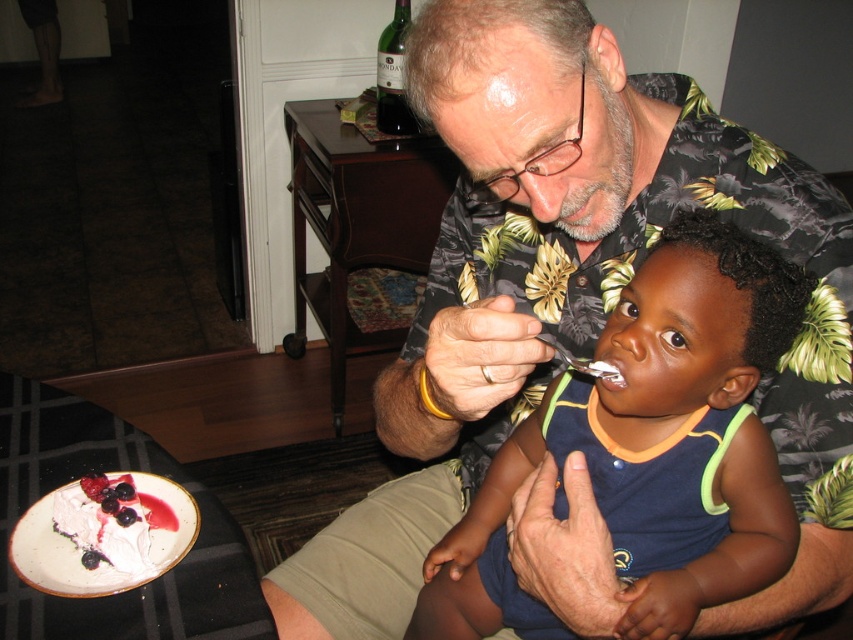
Question: Which point is farther to the camera?

Choices:
 (A) (495, 483)
 (B) (531, 532)
 (C) (85, 508)

Answer: (C)

Question: Does matte blue shirt at center have a lesser width compared to whipped cream topped with berries at lower left?

Choices:
 (A) yes
 (B) no

Answer: (B)

Question: Among these points, which one is farthest from the camera?

Choices:
 (A) (169, 532)
 (B) (654, 449)

Answer: (A)

Question: Is floral shirt at center positioned behind whipped cream topped with berries at lower left?

Choices:
 (A) yes
 (B) no

Answer: (B)

Question: Among these objects, which one is nearest to the camera?

Choices:
 (A) whipped cream topped with berries at lower left
 (B) floral shirt at center
 (C) matte blue shirt at center

Answer: (B)

Question: Can you confirm if floral shirt at center is positioned to the right of matte blue shirt at center?

Choices:
 (A) no
 (B) yes

Answer: (A)